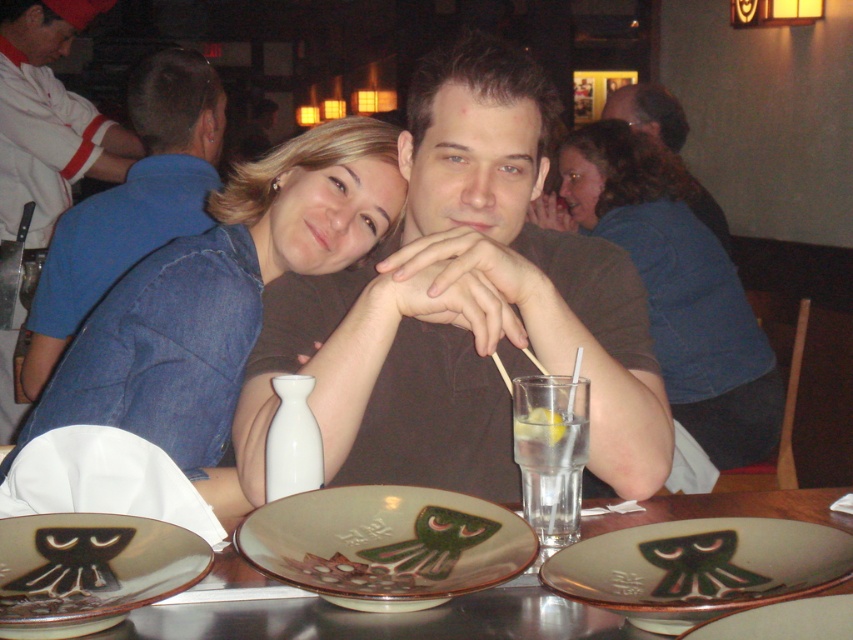
Question: Does denim shirt at upper left appear on the left side of blue denim jacket at upper center?

Choices:
 (A) yes
 (B) no

Answer: (A)

Question: Considering the relative positions of porcelain plate with green octopus at center and green glazed plate at center in the image provided, where is porcelain plate with green octopus at center located with respect to green glazed plate at center?

Choices:
 (A) below
 (B) above

Answer: (A)

Question: Is denim shirt at upper left smaller than green matte plate at center?

Choices:
 (A) yes
 (B) no

Answer: (B)

Question: Which point appears closest to the camera in this image?

Choices:
 (A) (474, 81)
 (B) (207, 614)
 (C) (770, 563)

Answer: (C)

Question: Which object is positioned farthest from the blue denim jacket at upper left?

Choices:
 (A) white matte chef hat at upper left
 (B) matte brown shirt at upper center
 (C) porcelain plate with green octopus at center

Answer: (B)

Question: Which object is the closest to the blue denim jacket at upper left?

Choices:
 (A) clear glass water at table center
 (B) green matte plate at center
 (C) denim shirt at upper left

Answer: (C)